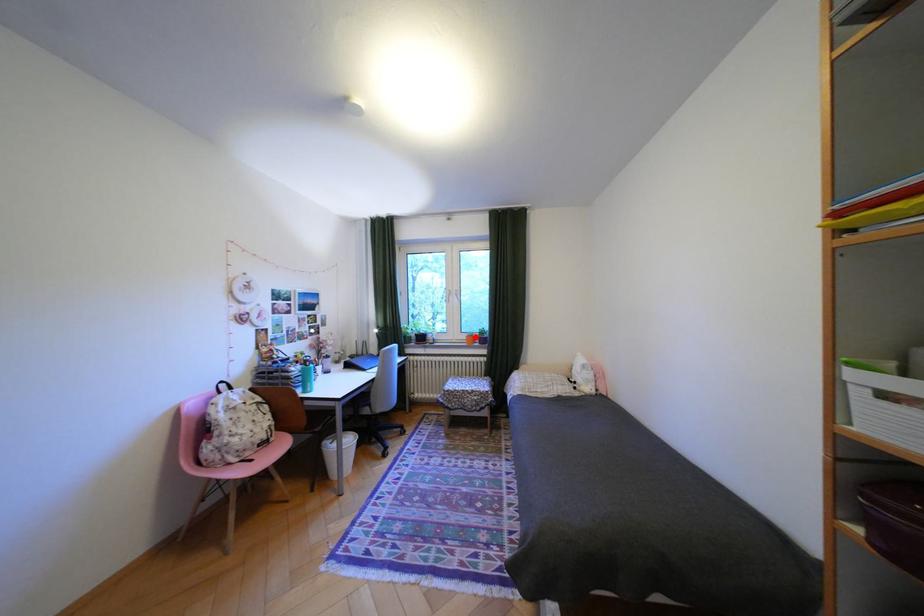
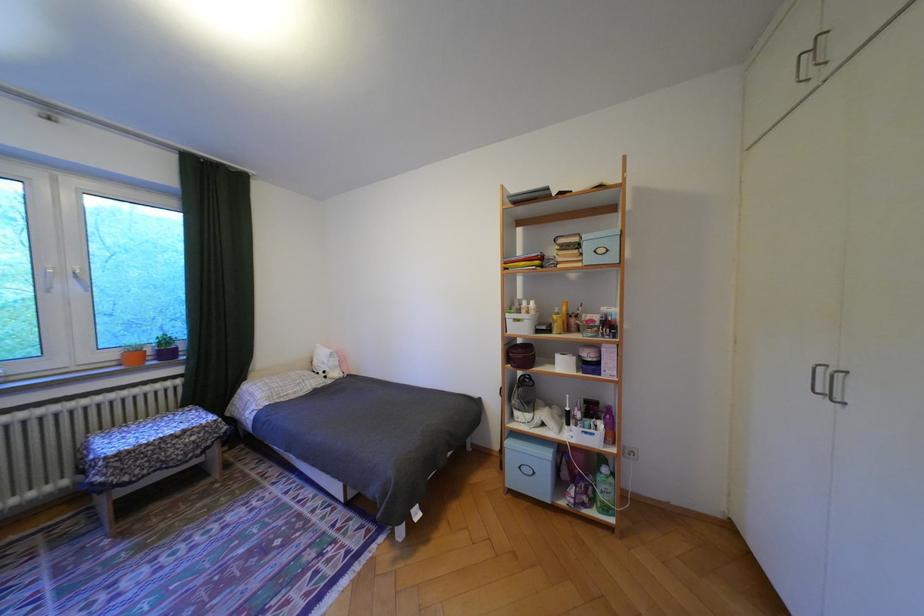
Question: I am providing you with two images of the same scene from different viewpoints. A red point is marked on the first image. At the location where the point appears in image 1, is it still visible in image 2?

Choices:
 (A) Yes
 (B) No

Answer: (A)